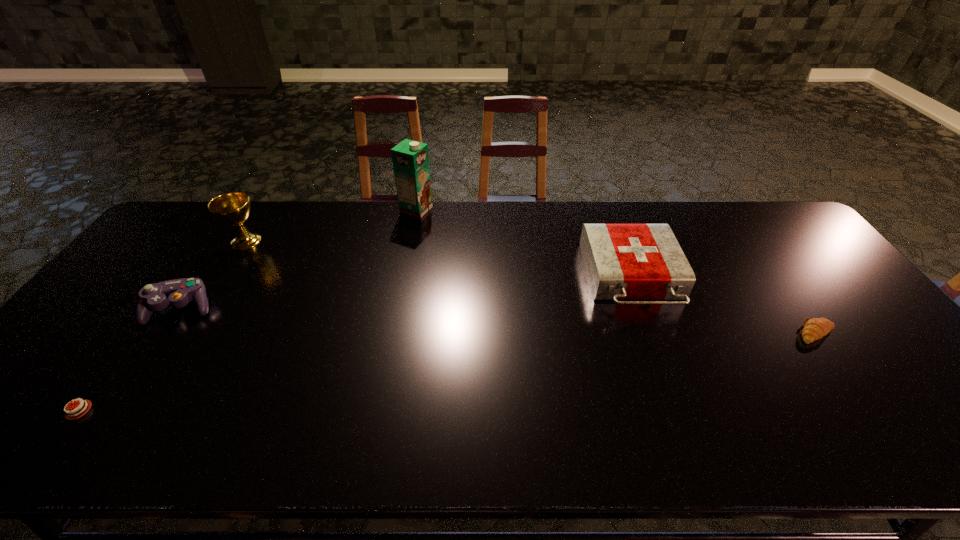
At what (x,y) coordinates should I click in order to perform the action: click on the farthest object. Please return your answer as a coordinate pair (x, y). Looking at the image, I should click on (410, 158).

Find the location of a particular element. The height and width of the screenshot is (540, 960). the third object from right to left is located at coordinates (410, 158).

Where is `the second tallest object`? The width and height of the screenshot is (960, 540). the second tallest object is located at coordinates (233, 208).

This screenshot has height=540, width=960. What are the coordinates of `the first-aid kit` in the screenshot? It's located at (623, 261).

In order to click on control in this screenshot , I will do `click(153, 297)`.

I want to click on the rightmost object, so click(x=814, y=329).

The image size is (960, 540). Find the location of `the second shortest object`. the second shortest object is located at coordinates pos(814,329).

In order to click on the nearest object in this screenshot , I will do `click(70, 415)`.

At what (x,y) coordinates should I click in order to perform the action: click on chocolate cake. Please return your answer as a coordinate pair (x, y). The image size is (960, 540). Looking at the image, I should click on (70, 415).

This screenshot has height=540, width=960. What are the coordinates of `vacant position located 0.160m on the front of the tallest object` in the screenshot? It's located at (409, 248).